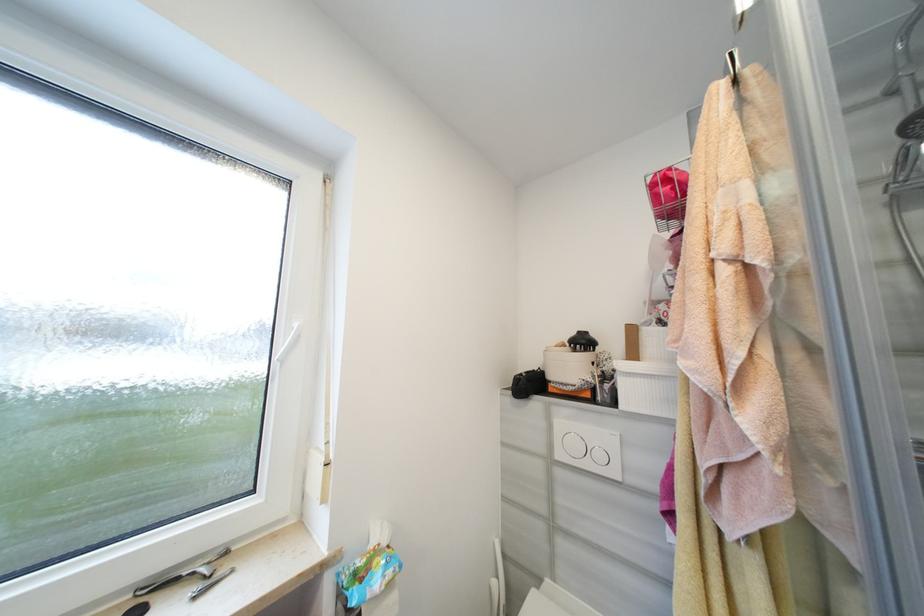
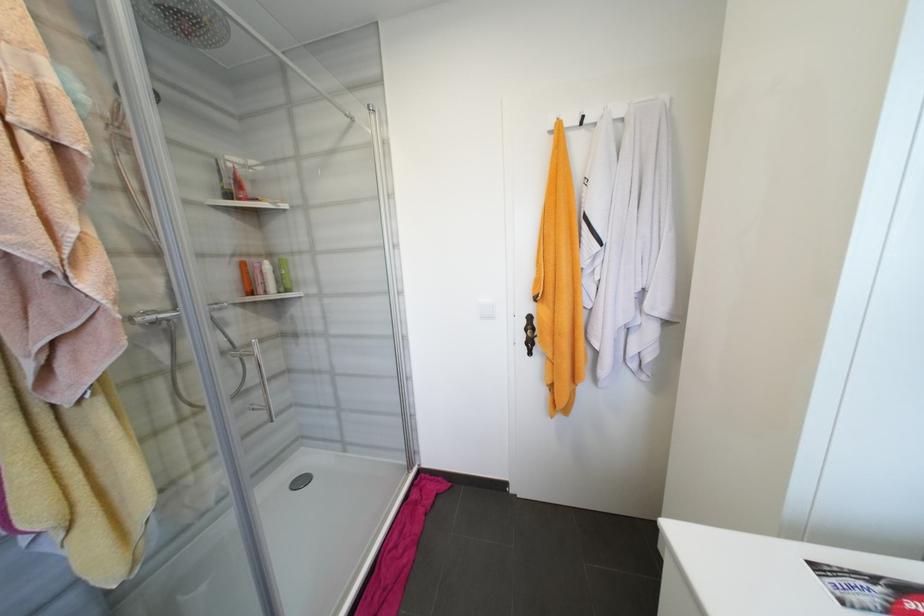
Question: How did the camera likely rotate?

Choices:
 (A) Left
 (B) Right
 (C) Up
 (D) Down

Answer: (B)